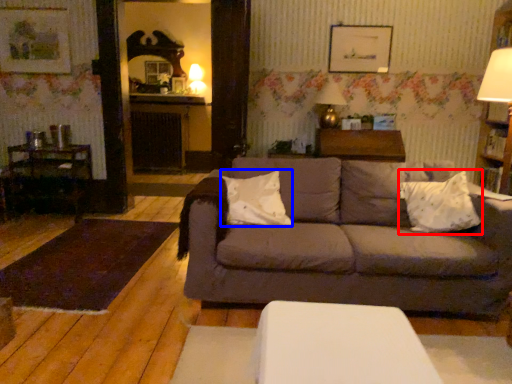
Question: Which object appears closest to the camera in this image, throw pillow (highlighted by a red box) or pillow (highlighted by a blue box)?

Choices:
 (A) throw pillow
 (B) pillow

Answer: (A)